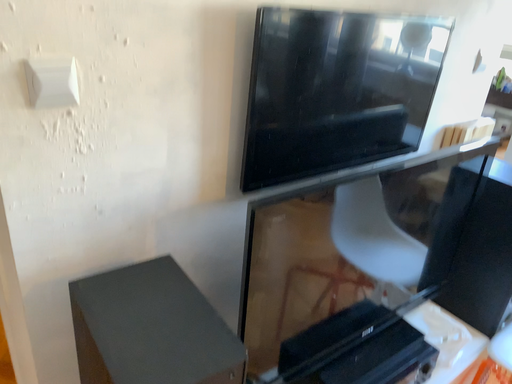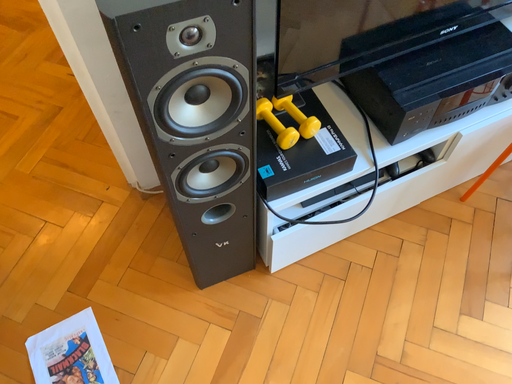
Question: How did the camera likely rotate when shooting the video?

Choices:
 (A) rotated downward
 (B) rotated upward

Answer: (A)